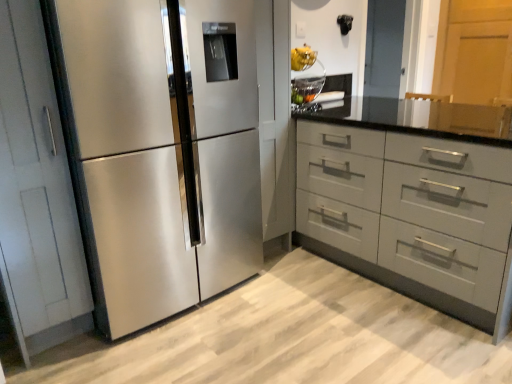
Question: Considering the positions of matte gray drawers at center-right and stainless steel refrigerator at left in the image, is matte gray drawers at center-right taller or shorter than stainless steel refrigerator at left?

Choices:
 (A) short
 (B) tall

Answer: (A)

Question: Is matte gray drawers at center-right wider or thinner than stainless steel refrigerator at left?

Choices:
 (A) thin
 (B) wide

Answer: (B)

Question: From the image's perspective, is matte gray drawers at center-right positioned above or below stainless steel refrigerator at left?

Choices:
 (A) below
 (B) above

Answer: (A)

Question: Considering the positions of stainless steel refrigerator at left and matte gray drawers at center-right in the image, is stainless steel refrigerator at left bigger or smaller than matte gray drawers at center-right?

Choices:
 (A) big
 (B) small

Answer: (B)

Question: From a real-world perspective, relative to matte gray drawers at center-right, is stainless steel refrigerator at left vertically above or below?

Choices:
 (A) below
 (B) above

Answer: (B)

Question: Looking at their shapes, would you say stainless steel refrigerator at left is wider or thinner than matte gray drawers at center-right?

Choices:
 (A) wide
 (B) thin

Answer: (B)

Question: Would you say stainless steel refrigerator at left is inside or outside matte gray drawers at center-right?

Choices:
 (A) inside
 (B) outside

Answer: (B)